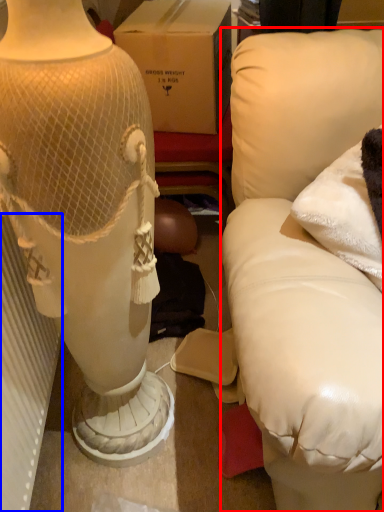
Question: Which object appears farthest to the camera in this image, furniture (highlighted by a red box) or radiator (highlighted by a blue box)?

Choices:
 (A) furniture
 (B) radiator

Answer: (B)